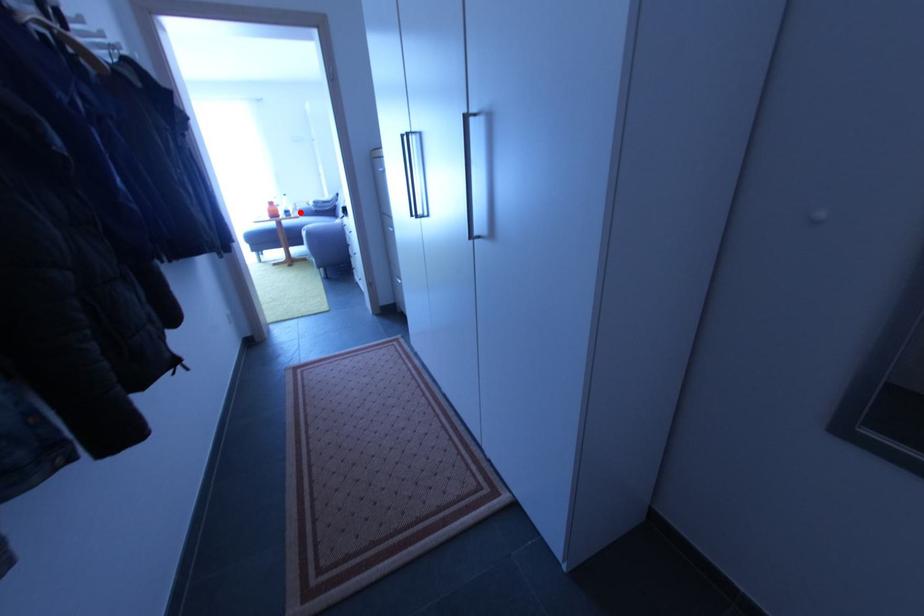
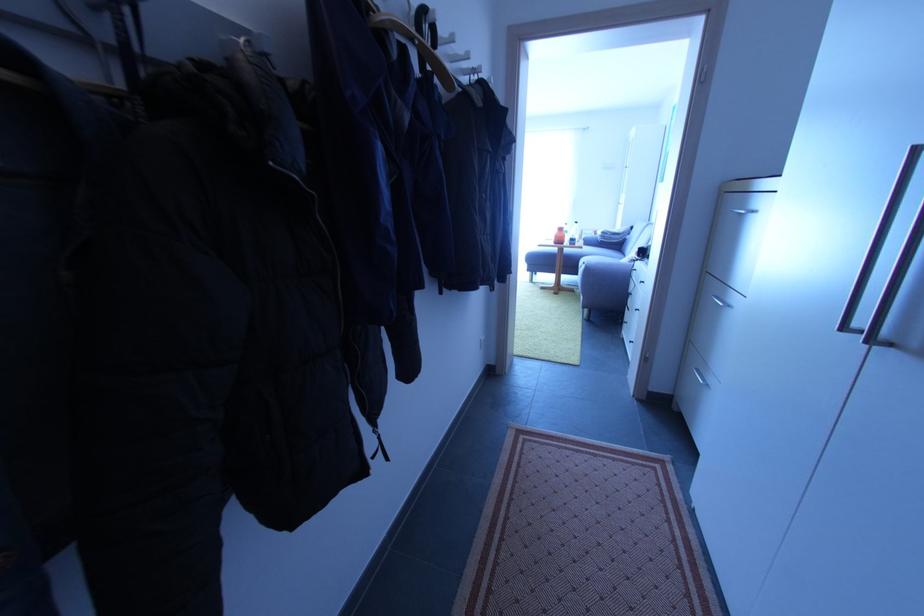
Where in the second image is the point corresponding to the highlighted location from the first image?

(585, 238)